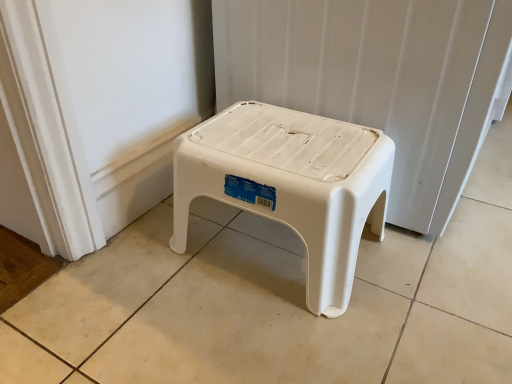
This screenshot has height=384, width=512. What are the coordinates of `vacant space to the right of white plastic stool at center` in the screenshot? It's located at (438, 278).